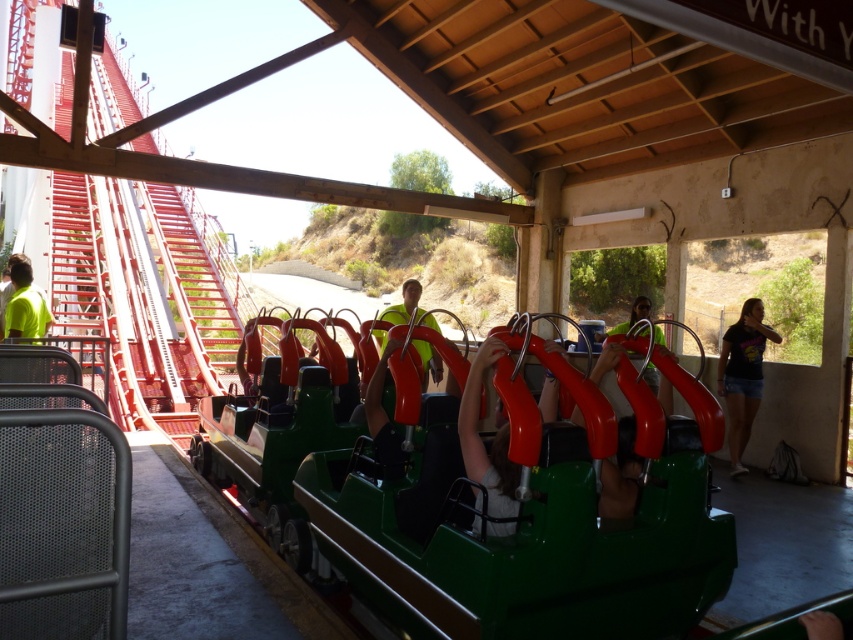
Question: In this image, where is matte black t-shirt at right located relative to matte red handlebar at center?

Choices:
 (A) right
 (B) left

Answer: (A)

Question: Among these points, which one is nearest to the camera?

Choices:
 (A) (630, 320)
 (B) (433, 349)

Answer: (B)

Question: Can you confirm if yellow high-visibility vest at left is smaller than matte red handlebar at center?

Choices:
 (A) no
 (B) yes

Answer: (B)

Question: Among these points, which one is farthest from the camera?

Choices:
 (A) (44, 304)
 (B) (740, 387)
 (C) (376, 332)

Answer: (B)

Question: Based on their relative distances, which object is farther from the matte yellow safety vest at center?

Choices:
 (A) matte red handlebar at center
 (B) yellow high-visibility vest at left

Answer: (B)

Question: Does yellow high-visibility vest at left appear on the right side of matte yellow safety vest at center?

Choices:
 (A) yes
 (B) no

Answer: (B)